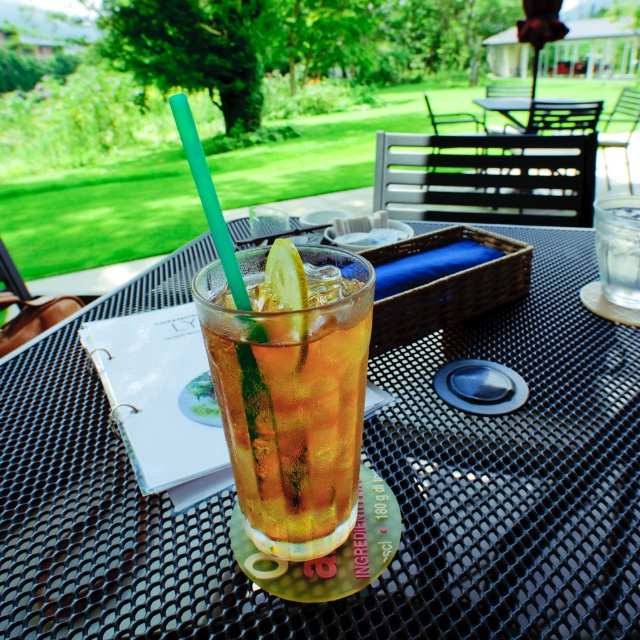
You are a customer looking for a seat at the black mesh table at center and the black metal table at center. Which one is located to the left?

The black mesh table at center is positioned on the left side of black metal table at center, so the black mesh table at center is the one located to the left.